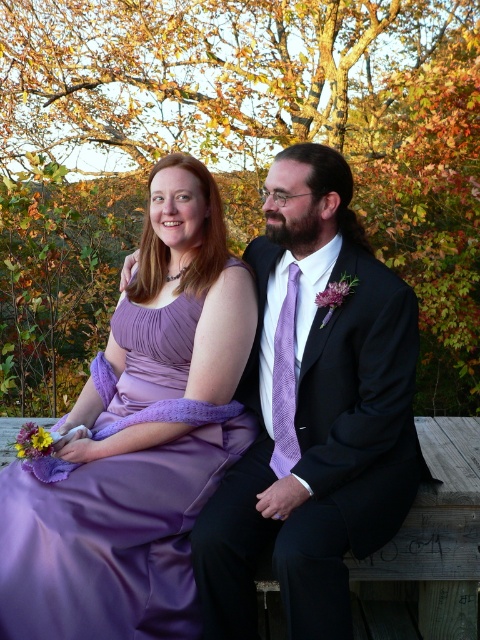
Question: Can you confirm if lavender satin dress at center is bigger than lavender textured tie at center?

Choices:
 (A) yes
 (B) no

Answer: (A)

Question: Does lavender satin dress at center have a greater width compared to lavender textured tie at center?

Choices:
 (A) no
 (B) yes

Answer: (B)

Question: Which of these objects is positioned closest to the lavender textured tie at center?

Choices:
 (A) matte black suit at center
 (B) lavender satin dress at center

Answer: (A)

Question: Which point appears closest to the camera in this image?

Choices:
 (A) (295, 410)
 (B) (75, 483)

Answer: (B)

Question: Does lavender satin dress at center appear on the left side of lavender textured tie at center?

Choices:
 (A) no
 (B) yes

Answer: (B)

Question: Which point is closer to the camera?

Choices:
 (A) lavender textured tie at center
 (B) lavender satin dress at center

Answer: (B)